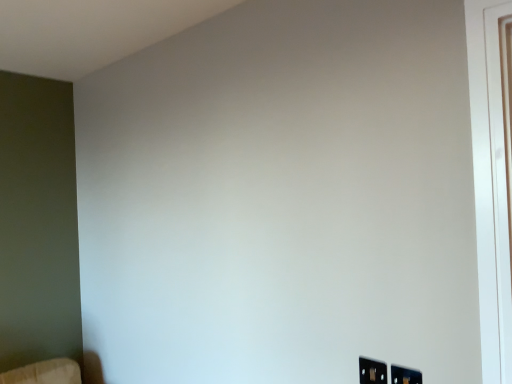
Question: Is black plastic electric outlet at lower right, the 1th electric outlet in the right-to-left sequence, not near black plastic electric outlet at lower right, placed as the first electric outlet when sorted from left to right?

Choices:
 (A) no
 (B) yes

Answer: (A)

Question: Is black plastic electric outlet at lower right, the 1th electric outlet positioned from the front, bigger than black plastic electric outlet at lower right, placed as the first electric outlet when sorted from left to right?

Choices:
 (A) yes
 (B) no

Answer: (A)

Question: Can you confirm if black plastic electric outlet at lower right, arranged as the 2th electric outlet when viewed from the back, is taller than black plastic electric outlet at lower right, the first electric outlet positioned from the back?

Choices:
 (A) no
 (B) yes

Answer: (B)

Question: From the image's perspective, is black plastic electric outlet at lower right, arranged as the 2th electric outlet when viewed from the left, below black plastic electric outlet at lower right, positioned as the 2th electric outlet in right-to-left order?

Choices:
 (A) yes
 (B) no

Answer: (A)

Question: Is black plastic electric outlet at lower right, the first electric outlet positioned from the back, at the back of black plastic electric outlet at lower right, arranged as the 2th electric outlet when viewed from the back?

Choices:
 (A) yes
 (B) no

Answer: (B)

Question: Is black plastic electric outlet at lower right, arranged as the 2th electric outlet when viewed from the back, at the right side of black plastic electric outlet at lower right, the first electric outlet positioned from the back?

Choices:
 (A) yes
 (B) no

Answer: (A)

Question: Is black plastic electric outlet at lower right, the first electric outlet positioned from the back, positioned far away from black plastic electric outlet at lower right, arranged as the 2th electric outlet when viewed from the back?

Choices:
 (A) yes
 (B) no

Answer: (B)

Question: Is the position of black plastic electric outlet at lower right, acting as the second electric outlet starting from the front, more distant than that of black plastic electric outlet at lower right, the 1th electric outlet in the right-to-left sequence?

Choices:
 (A) yes
 (B) no

Answer: (A)

Question: From the image's perspective, is black plastic electric outlet at lower right, acting as the second electric outlet starting from the front, over black plastic electric outlet at lower right, the 1th electric outlet positioned from the front?

Choices:
 (A) no
 (B) yes

Answer: (B)

Question: Is black plastic electric outlet at lower right, placed as the first electric outlet when sorted from left to right, looking in the opposite direction of black plastic electric outlet at lower right, arranged as the 2th electric outlet when viewed from the back?

Choices:
 (A) no
 (B) yes

Answer: (A)

Question: From a real-world perspective, is black plastic electric outlet at lower right, acting as the second electric outlet starting from the front, over black plastic electric outlet at lower right, arranged as the 2th electric outlet when viewed from the left?

Choices:
 (A) no
 (B) yes

Answer: (B)

Question: Considering the relative positions of black plastic electric outlet at lower right, acting as the second electric outlet starting from the front, and black plastic electric outlet at lower right, arranged as the 2th electric outlet when viewed from the back, in the image provided, is black plastic electric outlet at lower right, acting as the second electric outlet starting from the front, to the left of black plastic electric outlet at lower right, arranged as the 2th electric outlet when viewed from the back, from the viewer's perspective?

Choices:
 (A) no
 (B) yes

Answer: (B)

Question: Considering the relative positions of black plastic electric outlet at lower right, placed as the first electric outlet when sorted from left to right, and black plastic electric outlet at lower right, the 1th electric outlet positioned from the front, in the image provided, is black plastic electric outlet at lower right, placed as the first electric outlet when sorted from left to right, to the left or to the right of black plastic electric outlet at lower right, the 1th electric outlet positioned from the front,?

Choices:
 (A) right
 (B) left

Answer: (B)